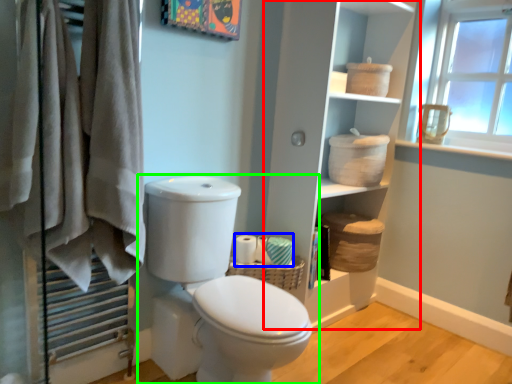
Question: Which object is the farthest from bookshelf (highlighted by a red box)? Choose among these: toilet paper (highlighted by a blue box) or toilet (highlighted by a green box).

Choices:
 (A) toilet paper
 (B) toilet

Answer: (B)